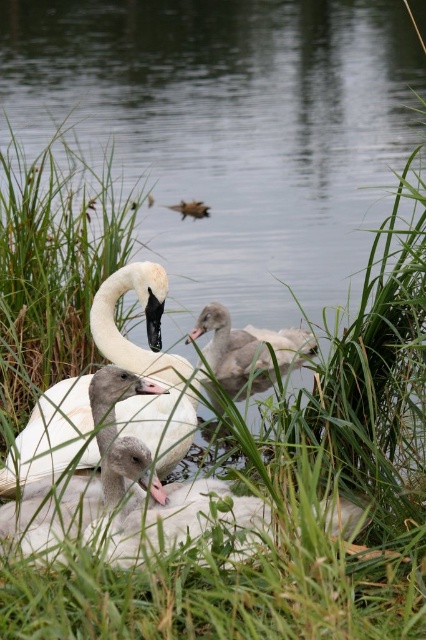
Question: Which object appears farthest from the camera in this image?

Choices:
 (A) gray downy duckling at center
 (B) white glossy swan at center
 (C) white fluffy swan at center

Answer: (A)

Question: Does white glossy swan at center have a larger size compared to white matte duckling at center?

Choices:
 (A) no
 (B) yes

Answer: (B)

Question: Which object is the farthest from the white fluffy swan at center?

Choices:
 (A) brown fuzzy duckling at center
 (B) gray downy duckling at center
 (C) white glossy swan at center
 (D) white matte duckling at center

Answer: (A)

Question: Does white glossy swan at center have a lesser width compared to gray downy duckling at center?

Choices:
 (A) yes
 (B) no

Answer: (B)

Question: Which point is farther to the camera?

Choices:
 (A) gray downy duckling at center
 (B) white matte duckling at center
 (C) white glossy swan at center

Answer: (A)

Question: Considering the relative positions of white matte duckling at center and gray downy duckling at center in the image provided, where is white matte duckling at center located with respect to gray downy duckling at center?

Choices:
 (A) above
 (B) below

Answer: (B)